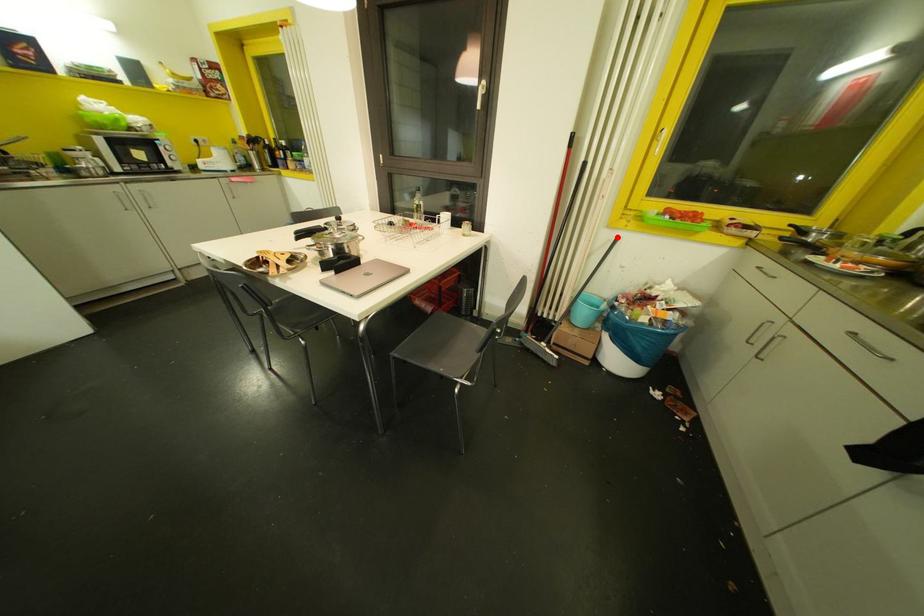
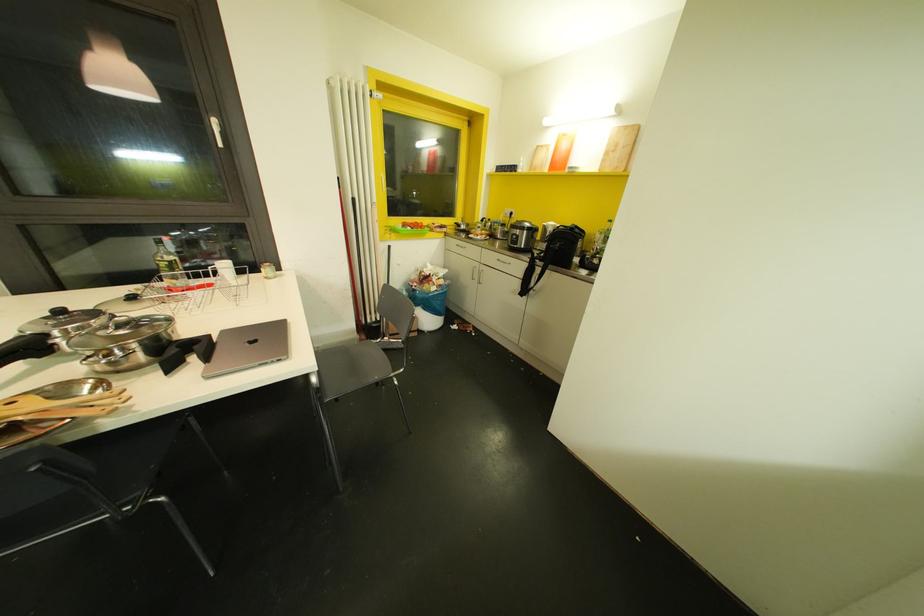
Question: I am providing you with two images of the same scene from different viewpoints. Image1 has a red point marked. In image2, the corresponding 3D location appears at what relative position? Reply with the corresponding letter.

Choices:
 (A) Closer
 (B) Farther

Answer: (A)